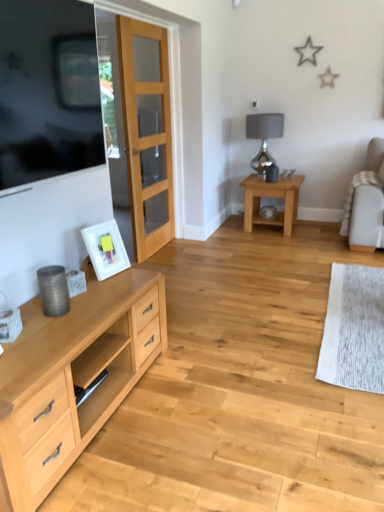
Question: From the image's perspective, would you say white matte picture frame at left is shown under white fabric chair at right?

Choices:
 (A) no
 (B) yes

Answer: (B)

Question: Considering the relative sizes of white matte picture frame at left and white fabric chair at right in the image provided, is white matte picture frame at left smaller than white fabric chair at right?

Choices:
 (A) no
 (B) yes

Answer: (B)

Question: Is white matte picture frame at left thinner than white fabric chair at right?

Choices:
 (A) no
 (B) yes

Answer: (B)

Question: Is white matte picture frame at left aimed at white fabric chair at right?

Choices:
 (A) no
 (B) yes

Answer: (A)

Question: From a real-world perspective, is white matte picture frame at left positioned under white fabric chair at right based on gravity?

Choices:
 (A) no
 (B) yes

Answer: (A)

Question: Considering the relative sizes of white matte picture frame at left and white fabric chair at right in the image provided, is white matte picture frame at left wider than white fabric chair at right?

Choices:
 (A) no
 (B) yes

Answer: (A)

Question: Is white matte picture frame at left facing away from clear glass door at center?

Choices:
 (A) yes
 (B) no

Answer: (B)

Question: Considering the relative sizes of white matte picture frame at left and clear glass door at center in the image provided, is white matte picture frame at left bigger than clear glass door at center?

Choices:
 (A) yes
 (B) no

Answer: (B)

Question: From the image's perspective, is white matte picture frame at left located beneath clear glass door at center?

Choices:
 (A) yes
 (B) no

Answer: (A)

Question: Is white matte picture frame at left next to clear glass door at center and touching it?

Choices:
 (A) yes
 (B) no

Answer: (B)

Question: Is white matte picture frame at left positioned before clear glass door at center?

Choices:
 (A) yes
 (B) no

Answer: (A)

Question: From a real-world perspective, is white matte picture frame at left physically above clear glass door at center?

Choices:
 (A) yes
 (B) no

Answer: (B)

Question: Can you confirm if white matte picture frame at left is smaller than light brown wooden table at center-right?

Choices:
 (A) no
 (B) yes

Answer: (B)